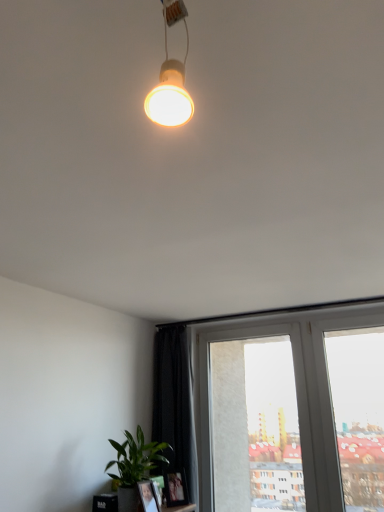
What do you see at coordinates (134, 468) in the screenshot? I see `green matte plant at lower left` at bounding box center [134, 468].

You are a GUI agent. You are given a task and a screenshot of the screen. Output one action in this format:
    pyautogui.click(x=<x>, y=<y>)
    Task: Click on the green matte plant at lower left
    The width and height of the screenshot is (384, 512).
    Given the screenshot: What is the action you would take?
    pyautogui.click(x=134, y=468)

Measure the distance between point (x=135, y=500) and camera.

The depth of point (x=135, y=500) is 2.29 meters.

This screenshot has height=512, width=384. I want to click on white plastic window frame at center, so click(x=255, y=421).

Describe the element at coordinates (255, 421) in the screenshot. This screenshot has height=512, width=384. I see `white plastic window frame at center` at that location.

Image resolution: width=384 pixels, height=512 pixels. Find the location of `green matte plant at lower left`. green matte plant at lower left is located at coordinates (134, 468).

Does green matte plant at lower left appear on the right side of white plastic window frame at center?

No.

Which is in front, green matte plant at lower left or white plastic window frame at center?

green matte plant at lower left is more forward.

Is point (118, 507) positioned after point (226, 479)?

No.

From the image's perspective, who appears lower, green matte plant at lower left or white plastic window frame at center?

white plastic window frame at center is shown below in the image.

From a real-world perspective, is green matte plant at lower left over white plastic window frame at center?

No, from a real-world perspective, green matte plant at lower left is not above white plastic window frame at center.

Considering the sizes of objects green matte plant at lower left and white plastic window frame at center in the image provided, who is wider, green matte plant at lower left or white plastic window frame at center?

green matte plant at lower left.

Considering the relative sizes of green matte plant at lower left and white plastic window frame at center in the image provided, is green matte plant at lower left taller than white plastic window frame at center?

Incorrect, the height of green matte plant at lower left is not larger of that of white plastic window frame at center.

Which of these two, green matte plant at lower left or white plastic window frame at center, is bigger?

white plastic window frame at center.

Based on the photo, is green matte plant at lower left located outside white plastic window frame at center?

Yes, green matte plant at lower left is outside of white plastic window frame at center.

Is green matte plant at lower left far from white plastic window frame at center?

Yes.

Is green matte plant at lower left facing towards white plastic window frame at center?

No, green matte plant at lower left is not facing towards white plastic window frame at center.

Can you tell me how much green matte plant at lower left and white plastic window frame at center differ in facing direction?

They differ by 88 degrees in their facing directions.

Identify the location of window frame on the right of green matte plant at lower left. (255, 421).

Is white plastic window frame at center to the left of green matte plant at lower left from the viewer's perspective?

No.

Between white plastic window frame at center and green matte plant at lower left, which one is positioned in front?

Positioned in front is green matte plant at lower left.

Considering the points (236, 490) and (124, 444), which point is behind, point (236, 490) or point (124, 444)?

The point (236, 490) is farther from the camera.

Based on the photo, from the image's perspective, which is above, white plastic window frame at center or green matte plant at lower left?

green matte plant at lower left, from the image's perspective.

Consider the image. From a real-world perspective, which is physically above, white plastic window frame at center or green matte plant at lower left?

white plastic window frame at center.

Which object is thinner, white plastic window frame at center or green matte plant at lower left?

Thinner between the two is white plastic window frame at center.

Which of these two, white plastic window frame at center or green matte plant at lower left, stands taller?

white plastic window frame at center is taller.

Considering the sizes of white plastic window frame at center and green matte plant at lower left in the image, is white plastic window frame at center bigger or smaller than green matte plant at lower left?

Considering their sizes, white plastic window frame at center takes up more space than green matte plant at lower left.

Do you think white plastic window frame at center is within green matte plant at lower left, or outside of it?

white plastic window frame at center lies outside green matte plant at lower left.

Are white plastic window frame at center and green matte plant at lower left far apart?

Yes, white plastic window frame at center is far from green matte plant at lower left.

Is white plastic window frame at center facing towards green matte plant at lower left?

Yes, white plastic window frame at center faces towards green matte plant at lower left.

Identify the location of window frame on the right of green matte plant at lower left. (255, 421).

Identify the location of window frame that is above the green matte plant at lower left (from a real-world perspective). (255, 421).

This screenshot has height=512, width=384. In order to click on houseplant on the left of the white plastic window frame at center in this screenshot , I will do `click(134, 468)`.